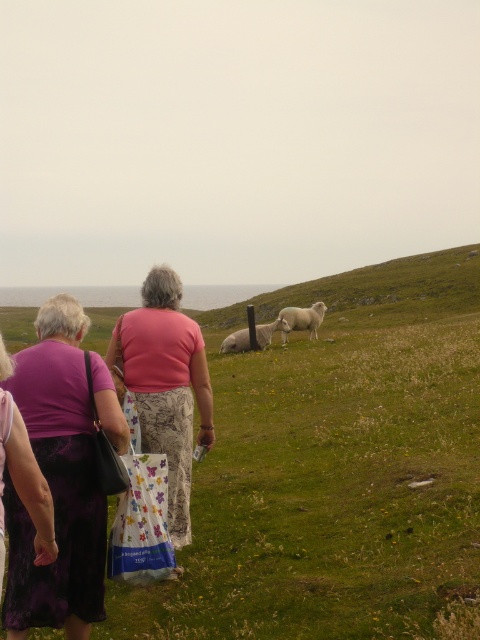
Is point (145, 304) positioned in front of point (297, 307)?

Yes.

At what (x,y) coordinates should I click in order to perform the action: click on pink fabric skirt at center. Please return your answer as a coordinate pair (x, y). The height and width of the screenshot is (640, 480). Looking at the image, I should click on (165, 385).

Does point (24, 454) come behind point (226, 342)?

No, (24, 454) is closer to viewer.

Describe the element at coordinates (24, 483) in the screenshot. I see `purple lace dress at lower left` at that location.

Which is behind, point (0, 396) or point (288, 330)?

The point (288, 330) is behind.

This screenshot has height=640, width=480. In order to click on purple lace dress at lower left in this screenshot , I will do `click(24, 483)`.

Is purple lace skirt at lower left smaller than purple lace dress at lower left?

No.

At what (x,y) coordinates should I click in order to perform the action: click on purple lace skirt at lower left. Please return your answer as a coordinate pair (x, y). Looking at the image, I should click on (57, 483).

Where is `purple lace skirt at lower left`? The image size is (480, 640). purple lace skirt at lower left is located at coordinates (57, 483).